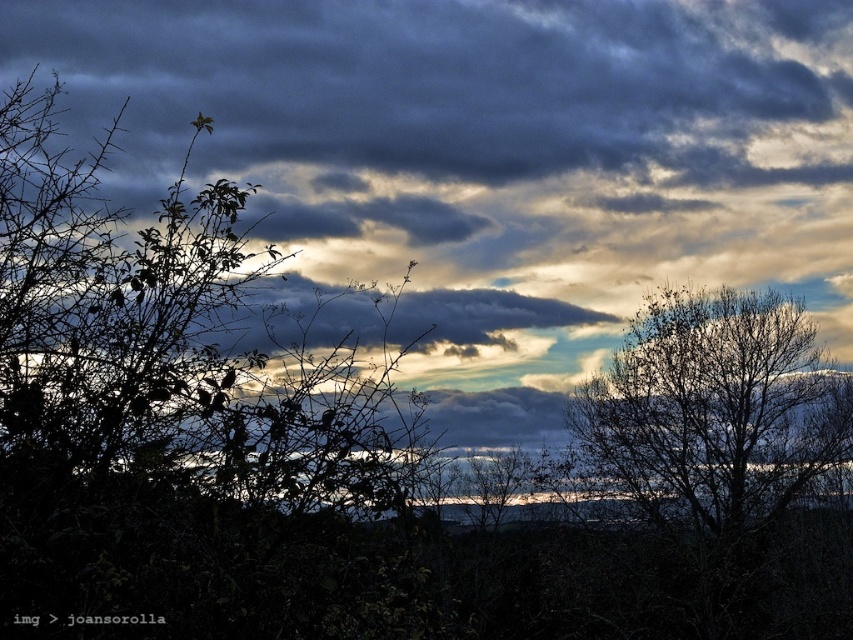
You are a bird flying in the sky scene described. You want to land on the closest object between the green matte tree at left and the bare branches at upper right. Which one should you choose?

The green matte tree at left is closer to your current position than the bare branches at upper right, so you should land on the green matte tree at left.

Consider the image. You are an artist trying to paint the scene. You want to paint the cloudy sky at upper center and the green matte tree at left. Which object should you paint first to create a sense of depth?

You should paint the cloudy sky at upper center first because it is closer to the viewer than the green matte tree at left, so painting it over the tree would create depth.